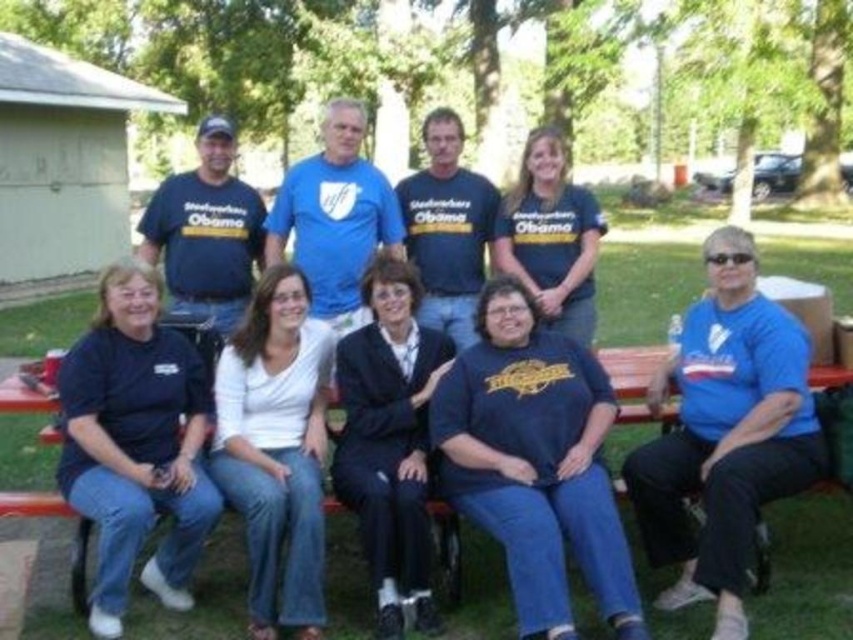
Question: Which point is farther to the camera?

Choices:
 (A) (582, 339)
 (B) (785, 420)

Answer: (A)

Question: Is blue matte shirt at lower right behind wooden park bench at lower center?

Choices:
 (A) yes
 (B) no

Answer: (B)

Question: Considering the relative positions of blue matte shirt at lower right and wooden park bench at lower center in the image provided, where is blue matte shirt at lower right located with respect to wooden park bench at lower center?

Choices:
 (A) below
 (B) above

Answer: (A)

Question: Which point appears closest to the camera in this image?

Choices:
 (A) (618, 634)
 (B) (769, 371)

Answer: (A)

Question: Is white cotton shirt at center thinner than wooden park bench at lower center?

Choices:
 (A) no
 (B) yes

Answer: (A)

Question: Considering the real-world distances, which object is closest to the matte black shirt at lower left?

Choices:
 (A) navy blue suit at center
 (B) white cotton shirt at center
 (C) dark blue jersey at center
 (D) blue matte shirt at lower right

Answer: (B)